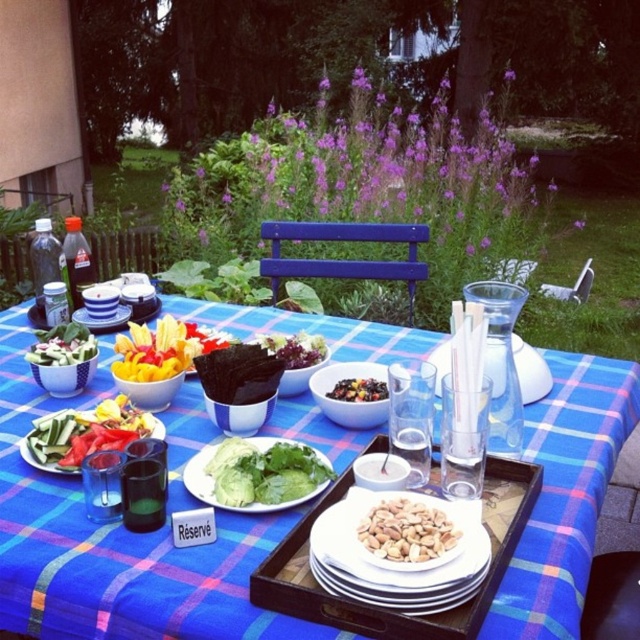
How distant is white matte plate at center from green leafy salad at center?

A distance of 6.37 inches exists between white matte plate at center and green leafy salad at center.

In the scene shown: Is white matte plate at center taller than green leafy salad at center?

No.

I want to click on white matte plate at center, so click(387, 548).

The height and width of the screenshot is (640, 640). What are the coordinates of `white matte plate at center` in the screenshot? It's located at (387, 548).

Can you confirm if white ceramic bowl at center is bigger than white matte plate at center?

Yes, white ceramic bowl at center is bigger than white matte plate at center.

How much distance is there between white ceramic bowl at center and white matte plate at center?

white ceramic bowl at center and white matte plate at center are 11.59 inches apart.

This screenshot has height=640, width=640. I want to click on white ceramic bowl at center, so click(x=115, y=544).

Does white ceramic bowl at center have a lesser width compared to shiny dark chocolate at center?

Incorrect, white ceramic bowl at center's width is not less than shiny dark chocolate at center's.

Is white ceramic bowl at center shorter than shiny dark chocolate at center?

In fact, white ceramic bowl at center may be taller than shiny dark chocolate at center.

Is point (67, 634) positioned in front of point (332, 390)?

Yes, it is.

Image resolution: width=640 pixels, height=640 pixels. Find the location of `white ceramic bowl at center`. white ceramic bowl at center is located at coordinates (115, 544).